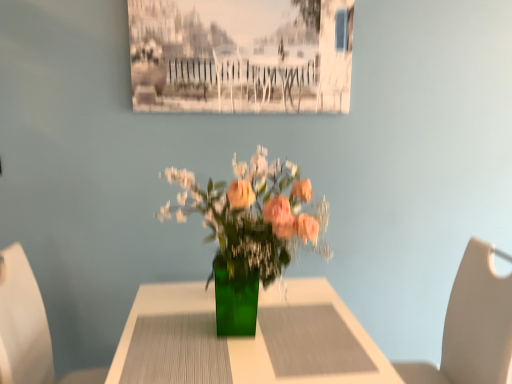
What do you see at coordinates (472, 325) in the screenshot? I see `beige leather chair at right, the 2th chair when ordered from left to right` at bounding box center [472, 325].

The width and height of the screenshot is (512, 384). What are the coordinates of `green glass vase at center` in the screenshot? It's located at (246, 340).

Does green glass vase at center lie in front of white plastic chair at left, which is counted as the first chair, starting from the left?

Yes, the depth of green glass vase at center is less than that of white plastic chair at left, which is counted as the first chair, starting from the left.

Considering the relative sizes of green glass vase at center and white plastic chair at left, which is counted as the first chair, starting from the left, in the image provided, is green glass vase at center wider than white plastic chair at left, which is counted as the first chair, starting from the left,?

Correct, the width of green glass vase at center exceeds that of white plastic chair at left, which is counted as the first chair, starting from the left.

Is green glass vase at center taller or shorter than white plastic chair at left, placed as the 2th chair when sorted from right to left?

green glass vase at center is shorter than white plastic chair at left, placed as the 2th chair when sorted from right to left.

Is green glass vase at center looking in the opposite direction of white plastic chair at left, placed as the 2th chair when sorted from right to left?

Yes.

Is point (2, 298) farther from camera compared to point (341, 377)?

Yes, it is.

From a real-world perspective, is white plastic chair at left, which is counted as the first chair, starting from the left, under green glass vase at center?

Actually, white plastic chair at left, which is counted as the first chair, starting from the left, is physically above green glass vase at center in the real world.

Considering the sizes of objects white plastic chair at left, which is counted as the first chair, starting from the left, and green glass vase at center in the image provided, who is wider, white plastic chair at left, which is counted as the first chair, starting from the left, or green glass vase at center?

green glass vase at center.

Is white plastic chair at left, placed as the 2th chair when sorted from right to left, touching green glass vase at center?

white plastic chair at left, placed as the 2th chair when sorted from right to left, and green glass vase at center are clearly separated.

Which is more to the right, beige leather chair at right, the 2th chair when ordered from left to right, or green glass vase at center?

Positioned to the right is beige leather chair at right, the 2th chair when ordered from left to right.

Considering the positions of objects beige leather chair at right, the 2th chair when ordered from left to right, and green glass vase at center in the image provided, who is in front, beige leather chair at right, the 2th chair when ordered from left to right, or green glass vase at center?

Positioned in front is green glass vase at center.

Considering the relative sizes of beige leather chair at right, the first chair in the right-to-left sequence, and green glass vase at center in the image provided, is beige leather chair at right, the first chair in the right-to-left sequence, shorter than green glass vase at center?

No, beige leather chair at right, the first chair in the right-to-left sequence, is not shorter than green glass vase at center.

Considering the relative sizes of beige leather chair at right, the first chair in the right-to-left sequence, and green glass vase at center in the image provided, is beige leather chair at right, the first chair in the right-to-left sequence, wider than green glass vase at center?

No, beige leather chair at right, the first chair in the right-to-left sequence, is not wider than green glass vase at center.

How much distance is there between green glass vase at center and beige leather chair at right, the 2th chair when ordered from left to right?

29.41 inches.

Considering the positions of objects green glass vase at center and beige leather chair at right, the first chair in the right-to-left sequence, in the image provided, who is more to the right, green glass vase at center or beige leather chair at right, the first chair in the right-to-left sequence,?

beige leather chair at right, the first chair in the right-to-left sequence.

Looking at this image, from a real-world perspective, is green glass vase at center physically located above or below beige leather chair at right, the 2th chair when ordered from left to right?

green glass vase at center is below beige leather chair at right, the 2th chair when ordered from left to right.

Considering the positions of objects green glass vase at center and beige leather chair at right, the 2th chair when ordered from left to right, in the image provided, who is in front, green glass vase at center or beige leather chair at right, the 2th chair when ordered from left to right,?

green glass vase at center is more forward.

Can you confirm if beige leather chair at right, the 2th chair when ordered from left to right, is taller than white plastic chair at left, placed as the 2th chair when sorted from right to left?

Indeed, beige leather chair at right, the 2th chair when ordered from left to right, has a greater height compared to white plastic chair at left, placed as the 2th chair when sorted from right to left.

Are beige leather chair at right, the first chair in the right-to-left sequence, and white plastic chair at left, placed as the 2th chair when sorted from right to left, making contact?

No, beige leather chair at right, the first chair in the right-to-left sequence, is not next to white plastic chair at left, placed as the 2th chair when sorted from right to left.

Considering the points (477, 325) and (12, 282), which point is behind, point (477, 325) or point (12, 282)?

The point (477, 325) is more distant.

Is beige leather chair at right, the first chair in the right-to-left sequence, located within white plastic chair at left, placed as the 2th chair when sorted from right to left?

That's incorrect, beige leather chair at right, the first chair in the right-to-left sequence, is not inside white plastic chair at left, placed as the 2th chair when sorted from right to left.

Does point (2, 333) come farther from viewer compared to point (453, 318)?

No.

From the image's perspective, which one is positioned lower, white plastic chair at left, which is counted as the first chair, starting from the left, or beige leather chair at right, the first chair in the right-to-left sequence?

beige leather chair at right, the first chair in the right-to-left sequence, is shown below in the image.

Which is behind, white plastic chair at left, which is counted as the first chair, starting from the left, or beige leather chair at right, the 2th chair when ordered from left to right?

beige leather chair at right, the 2th chair when ordered from left to right, is further away from the camera.

From the image's perspective, starting from the green glass vase at center, which chair is the 2nd one above? Please provide its 2D coordinates.

[(22, 323)]

Find the location of a particular element. The image size is (512, 384). chair on the left side of green glass vase at center is located at coordinates (22, 323).

Which object lies nearer to the anchor point white plastic chair at left, placed as the 2th chair when sorted from right to left, beige leather chair at right, the first chair in the right-to-left sequence, or green glass vase at center?

Based on the image, green glass vase at center appears to be nearer to white plastic chair at left, placed as the 2th chair when sorted from right to left.

Based on their spatial positions, is white plastic chair at left, placed as the 2th chair when sorted from right to left, or green glass vase at center further from beige leather chair at right, the first chair in the right-to-left sequence?

white plastic chair at left, placed as the 2th chair when sorted from right to left, is further to beige leather chair at right, the first chair in the right-to-left sequence.

Which object lies nearer to the anchor point green glass vase at center, beige leather chair at right, the 2th chair when ordered from left to right, or white plastic chair at left, which is counted as the first chair, starting from the left?

The object closer to green glass vase at center is white plastic chair at left, which is counted as the first chair, starting from the left.

Considering their positions, is green glass vase at center positioned further to white plastic chair at left, which is counted as the first chair, starting from the left, than beige leather chair at right, the 2th chair when ordered from left to right?

beige leather chair at right, the 2th chair when ordered from left to right, lies further to white plastic chair at left, which is counted as the first chair, starting from the left, than the other object.

Estimate the real-world distances between objects in this image. Which object is further from green glass vase at center, white plastic chair at left, placed as the 2th chair when sorted from right to left, or beige leather chair at right, the first chair in the right-to-left sequence?

Among the two, beige leather chair at right, the first chair in the right-to-left sequence, is located further to green glass vase at center.

Which object lies further to the anchor point beige leather chair at right, the 2th chair when ordered from left to right, green glass vase at center or white plastic chair at left, placed as the 2th chair when sorted from right to left?

white plastic chair at left, placed as the 2th chair when sorted from right to left, is further to beige leather chair at right, the 2th chair when ordered from left to right.

The image size is (512, 384). I want to click on table situated between white plastic chair at left, placed as the 2th chair when sorted from right to left, and beige leather chair at right, the 2th chair when ordered from left to right, from left to right, so click(246, 340).